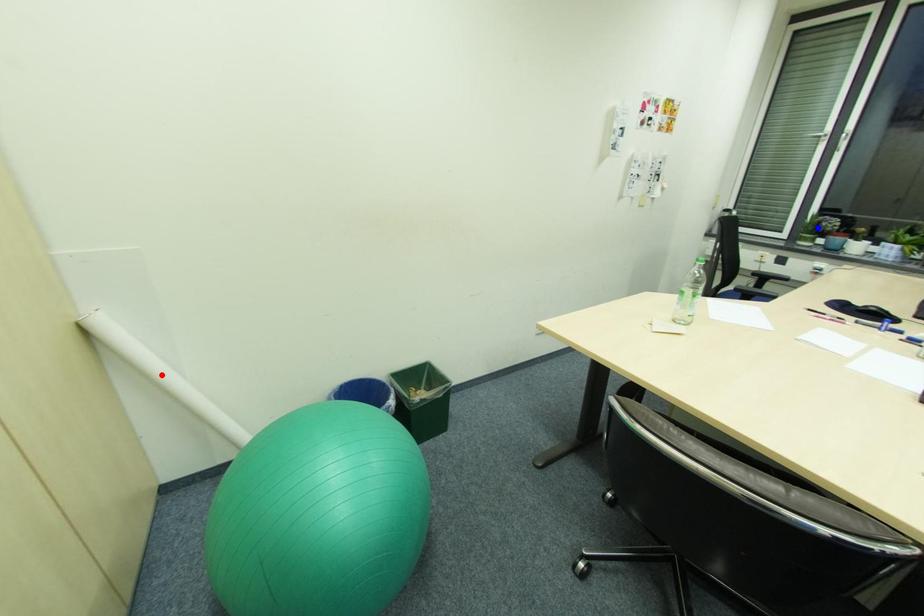
Question: Which of the two points in the image is closer to the camera?

Choices:
 (A) Blue point is closer.
 (B) Red point is closer.

Answer: (B)